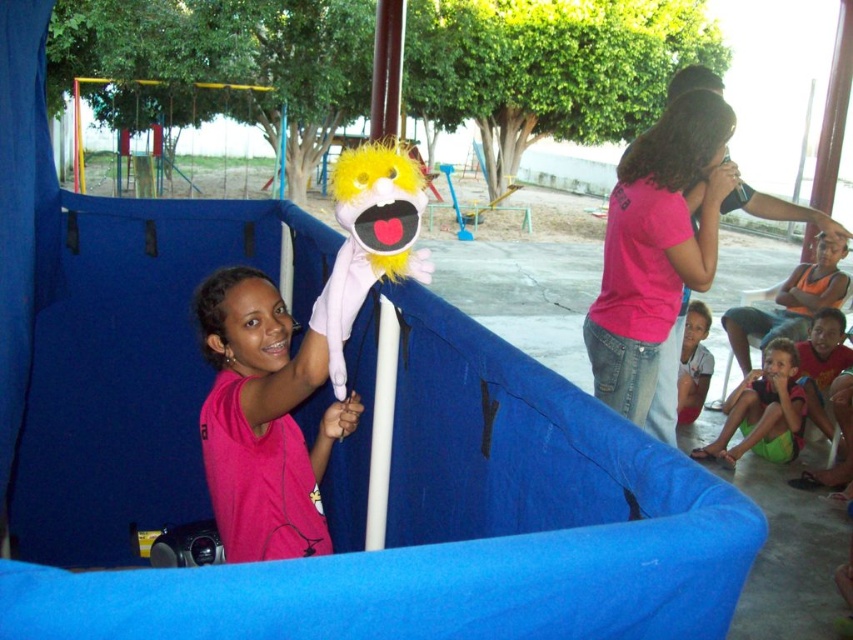
Question: Can you confirm if fuzzy yellow puppet at center is positioned above green fabric shorts at lower right?

Choices:
 (A) no
 (B) yes

Answer: (B)

Question: Which object is farther from the camera taking this photo?

Choices:
 (A) green fabric shorts at lower right
 (B) blue fabric slide at center
 (C) light brown hair at lower right

Answer: (C)

Question: Which of the following is the closest to the observer?

Choices:
 (A) fuzzy yellow puppet at center
 (B) blue fabric slide at center
 (C) pink cotton shirt at upper right

Answer: (B)

Question: Is fuzzy yellow puppet at center smaller than light brown hair at lower right?

Choices:
 (A) no
 (B) yes

Answer: (B)

Question: Estimate the real-world distances between objects in this image. Which object is farther from the pink cotton shirt at upper right?

Choices:
 (A) pink matte shirt at center
 (B) blue fabric slide at center

Answer: (A)

Question: Does green fabric shorts at lower right appear on the left side of light brown hair at lower right?

Choices:
 (A) yes
 (B) no

Answer: (B)